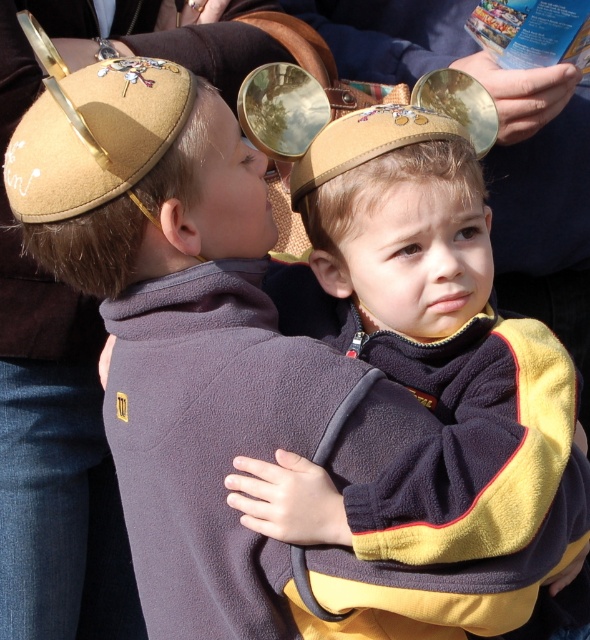
Can you confirm if matte brown hat at center is wider than suede kippah at upper left?

No.

Which is more to the right, matte brown hat at center or suede kippah at upper left?

matte brown hat at center

Is point (486, 240) positioned after point (45, 198)?

That is True.

Identify the location of matte brown hat at center. The width and height of the screenshot is (590, 640). (398, 220).

Is point (424, 339) farther from viewer compared to point (225, 188)?

That is True.

Locate an element on the screen. This screenshot has height=640, width=590. matte brown sweater at center is located at coordinates (414, 348).

Find the location of `matte brown sweater at center`. matte brown sweater at center is located at coordinates (414, 348).

Between matte brown sweater at center and matte brown hat at center, which one is positioned lower?

Positioned lower is matte brown sweater at center.

Which is more to the left, matte brown sweater at center or matte brown hat at center?

matte brown hat at center

Is point (438, 168) farther from viewer compared to point (432, 140)?

No, (438, 168) is closer to viewer.

Locate an element on the screen. matte brown sweater at center is located at coordinates (414, 348).